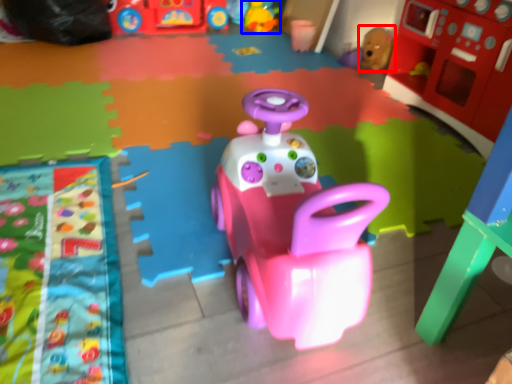
Question: Among these objects, which one is nearest to the camera, toy (highlighted by a red box) or toy (highlighted by a blue box)?

Choices:
 (A) toy
 (B) toy

Answer: (A)